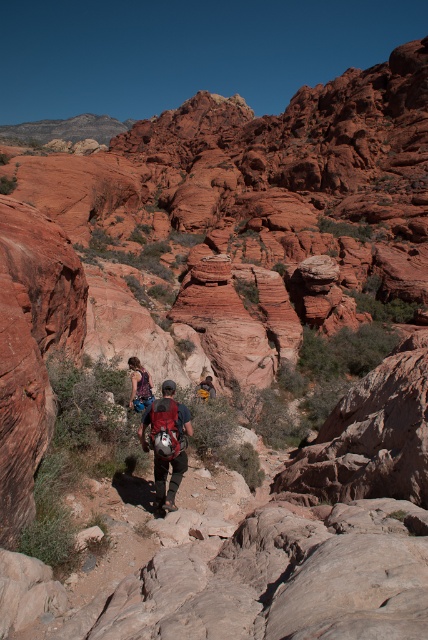
Question: Is matte red backpack at center wider than brown leather backpack at center?

Choices:
 (A) no
 (B) yes

Answer: (B)

Question: Estimate the real-world distances between objects in this image. Which object is farther from the denim jacket at center?

Choices:
 (A) matte red backpack at center
 (B) brown leather backpack at center

Answer: (B)

Question: Which of the following is the closest to the observer?

Choices:
 (A) (133, 374)
 (B) (211, 381)
 (C) (155, 481)

Answer: (C)

Question: Does denim jacket at center lie behind brown leather backpack at center?

Choices:
 (A) yes
 (B) no

Answer: (B)

Question: Does matte red backpack at center lie in front of brown leather backpack at center?

Choices:
 (A) no
 (B) yes

Answer: (B)

Question: Which of the following is the closest to the observer?

Choices:
 (A) (169, 448)
 (B) (133, 380)
 (C) (211, 385)

Answer: (A)